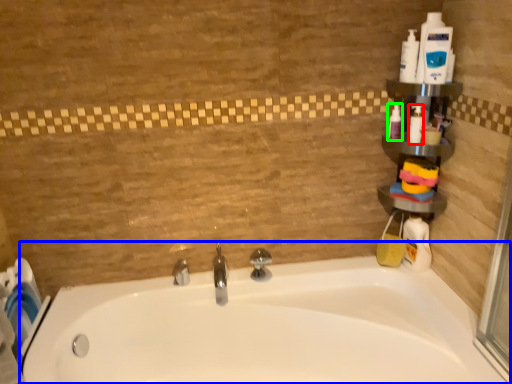
Question: Which object is positioned farthest from cleaning product (highlighted by a red box)? Select from bathtub (highlighted by a blue box) and cleaning product (highlighted by a green box).

Choices:
 (A) bathtub
 (B) cleaning product

Answer: (A)